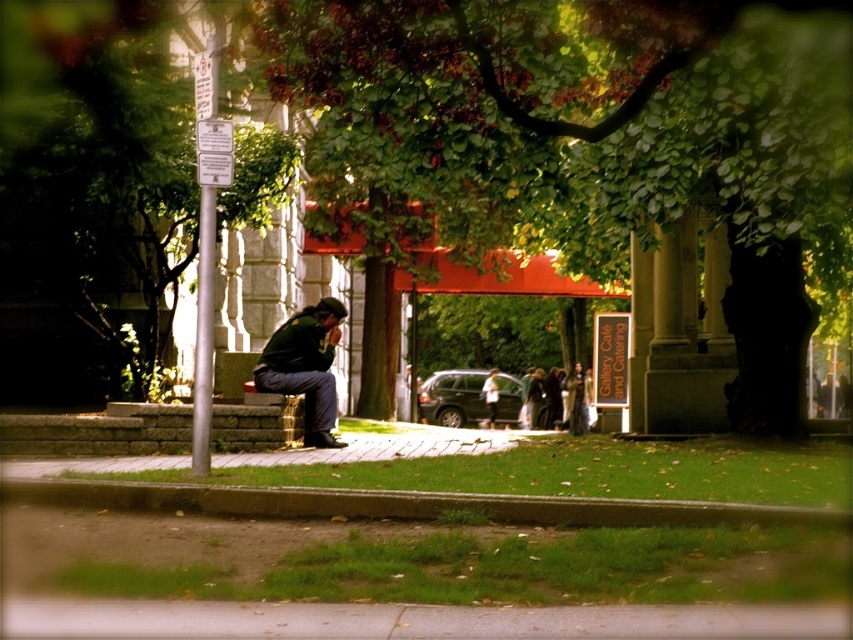
You are a park visitor who wants to place a 2.5 meter long banner between the green leafy tree at left and the green fabric jacket at center. Is there enough space between them to stretch the banner without folding it?

The distance between the green leafy tree at left and the green fabric jacket at center is 2.21 meters. Since the banner is 2.5 meters long, it is longer than the available space. Therefore, the banner cannot be stretched fully between them without folding.

You are standing in the park and see a person wearing a green fabric jacket at center and a white cotton shirt at center. Which piece of clothing is nearer to you?

The green fabric jacket at center is closer to the viewer than the white cotton shirt at center.